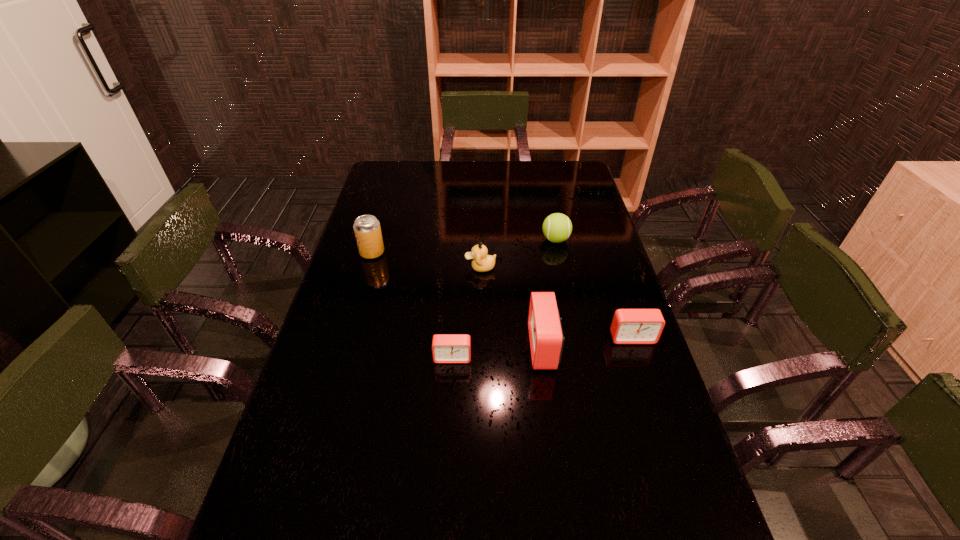
Locate an element on the screen. blank region between the duckling and the shortest alarm clock is located at coordinates (467, 312).

This screenshot has height=540, width=960. Identify the location of free space between the tallest alarm clock and the shortest alarm clock. (498, 352).

Find the location of a particular element. The width and height of the screenshot is (960, 540). vacant region between the leftmost object and the second object from right to left is located at coordinates (464, 246).

This screenshot has width=960, height=540. Find the location of `free spot between the rightmost object and the duckling`. free spot between the rightmost object and the duckling is located at coordinates [556, 302].

The width and height of the screenshot is (960, 540). What are the coordinates of `vacant space that's between the fourth object from left to right and the second tallest alarm clock` in the screenshot? It's located at (588, 342).

Select which object is the fourth closest to the duckling. Please provide its 2D coordinates. Your answer should be formatted as a tuple, i.e. [(x, y)], where the tuple contains the x and y coordinates of a point satisfying the conditions above.

[(446, 348)]

Choose which object is the third nearest neighbor to the shortest object. Please provide its 2D coordinates. Your answer should be formatted as a tuple, i.e. [(x, y)], where the tuple contains the x and y coordinates of a point satisfying the conditions above.

[(629, 326)]

Select which alarm clock is the third closest to the duckling. Please provide its 2D coordinates. Your answer should be formatted as a tuple, i.e. [(x, y)], where the tuple contains the x and y coordinates of a point satisfying the conditions above.

[(629, 326)]

Identify which alarm clock is located as the nearest to the leftmost alarm clock. Please provide its 2D coordinates. Your answer should be formatted as a tuple, i.e. [(x, y)], where the tuple contains the x and y coordinates of a point satisfying the conditions above.

[(546, 338)]

Find the location of a particular element. This screenshot has height=540, width=960. vacant space that satisfies the following two spatial constraints: 1. on the face of the duckling; 2. on the front-facing side of the shortest alarm clock is located at coordinates (480, 357).